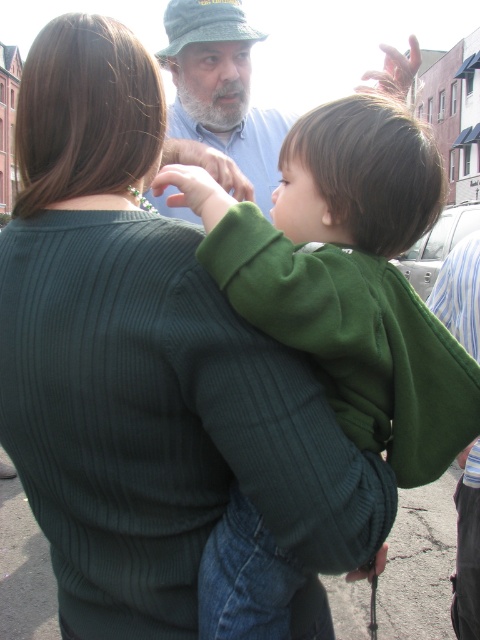
Who is positioned more to the left, green corduroy sweater at center or light blue shirt at upper center?

light blue shirt at upper center is more to the left.

Who is more forward, (421, 422) or (271, 180)?

Positioned in front is point (421, 422).

Which is behind, point (310, 280) or point (206, 51)?

The point (206, 51) is behind.

Locate an element on the screen. The width and height of the screenshot is (480, 640). green corduroy sweater at center is located at coordinates (348, 276).